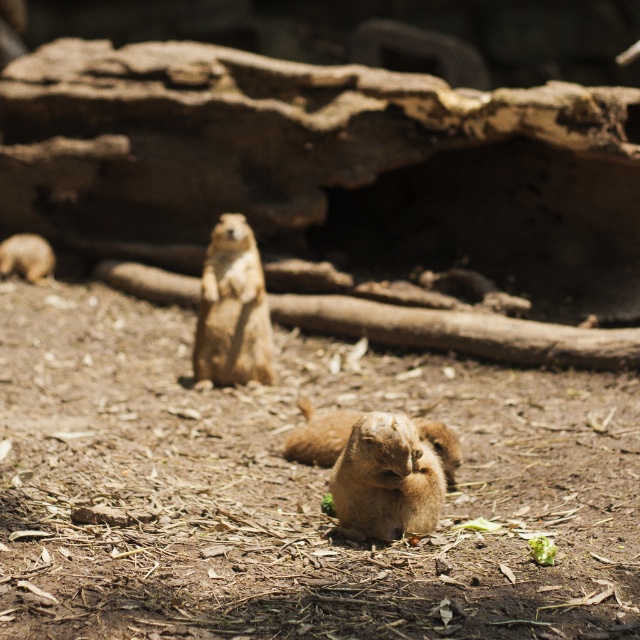
You are a zookeeper observing two squirrels in the enclosure. You notice a golden fur squirrel at center and a fuzzy brown squirrel at center. Which squirrel is taller?

The golden fur squirrel at center is taller than the fuzzy brown squirrel at center.

From the picture: You are a zookeeper trying to locate the golden fur squirrel at center in its enclosure. The enclosure is a coordinate grid where the bottom left corner is the origin point. The squirrel is at point 0.483, 0.364. Which direction should you walk from the origin to find it?

The golden fur squirrel at center is located at coordinate point 0.483 on the x axis and 0.364 on the y axis. To reach it from the origin at the bottom left corner, you should walk northeast, moving both eastward and northward.

You are a photographer trying to capture both the fuzzy brown squirrel at center and the brown furry squirrel at left. Since you can only focus on one squirrel at a time, which squirrel should you focus on to ensure the other remains in the background?

You should focus on the fuzzy brown squirrel at center because it is closer to the viewer, making the brown furry squirrel at left naturally appear in the background.